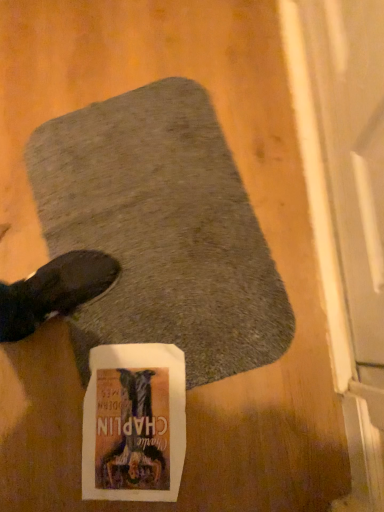
Where is `vacant space situated on the left part of white paper flyer at center`? vacant space situated on the left part of white paper flyer at center is located at coordinates (44, 448).